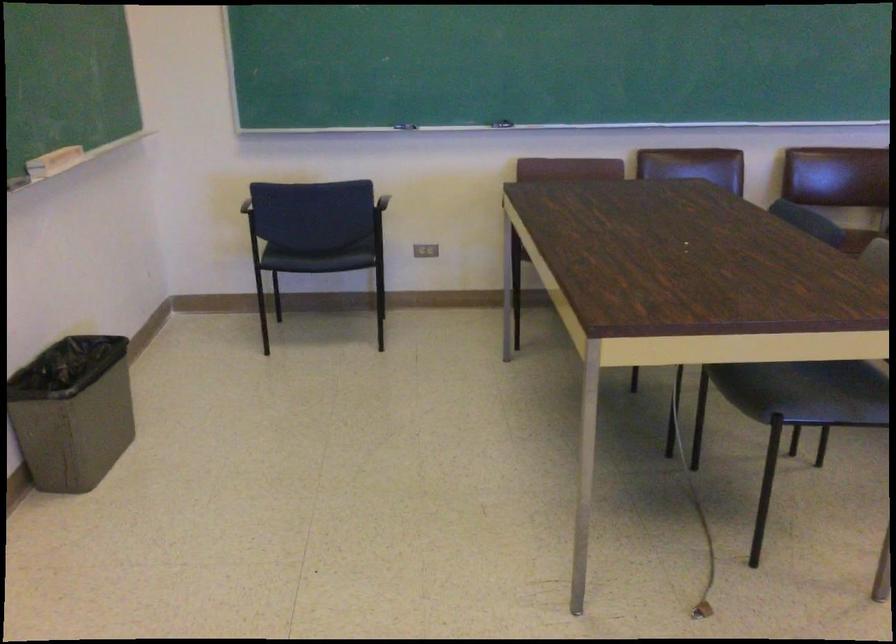
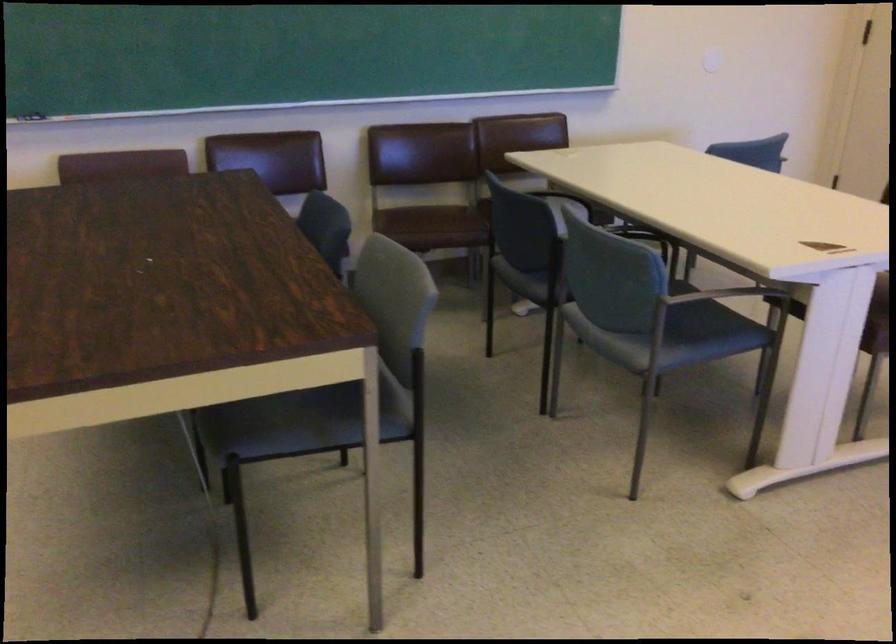
Question: The camera is either moving clockwise (left) or counter-clockwise (right) around the object. The first image is from the beginning of the video and the second image is from the end. Is the camera moving left or right when shooting the video?

Choices:
 (A) Left
 (B) Right

Answer: (A)